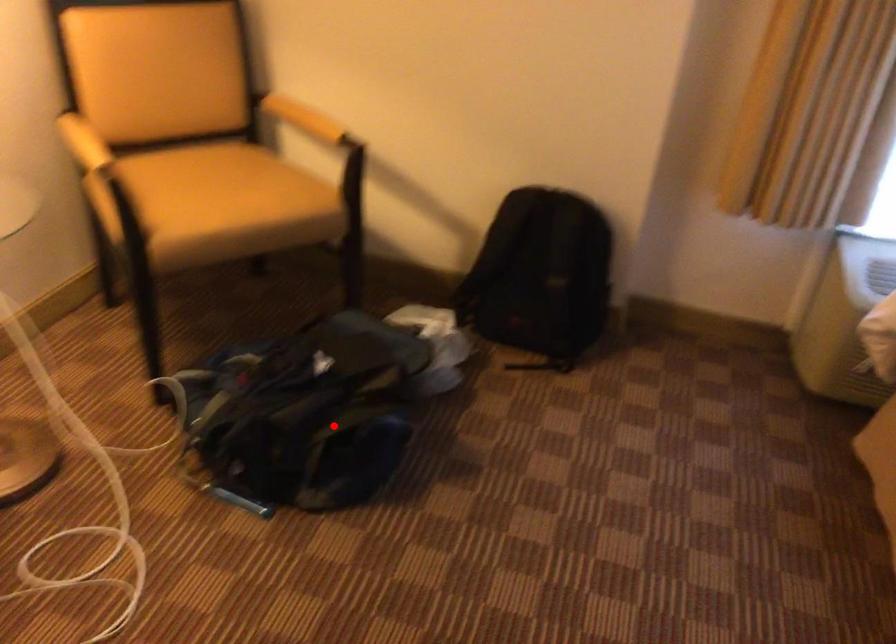
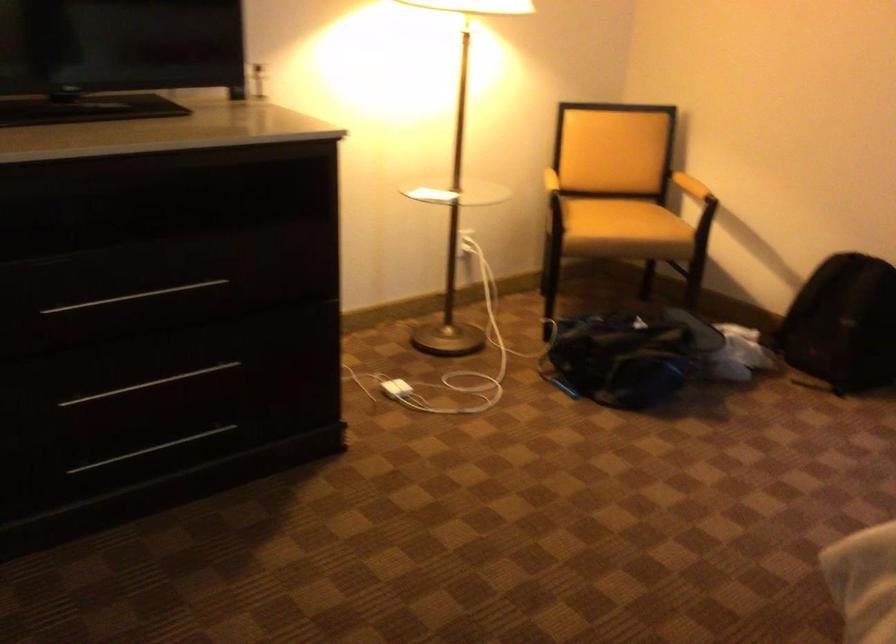
Question: I am providing you with two images of the same scene from different viewpoints. Given a red point in image1, look at the same physical point in image2. Is it:

Choices:
 (A) Closer to the viewpoint
 (B) Farther from the viewpoint

Answer: (B)